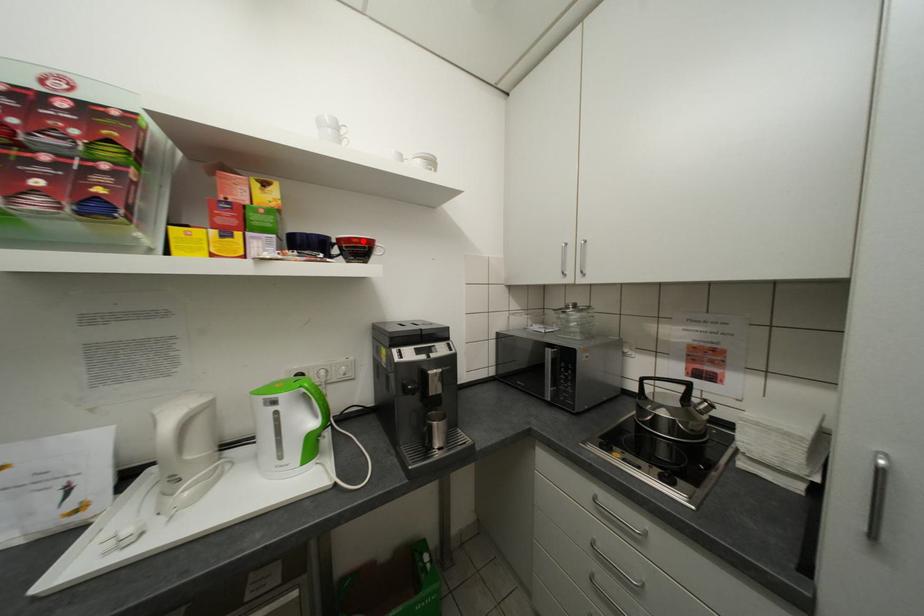
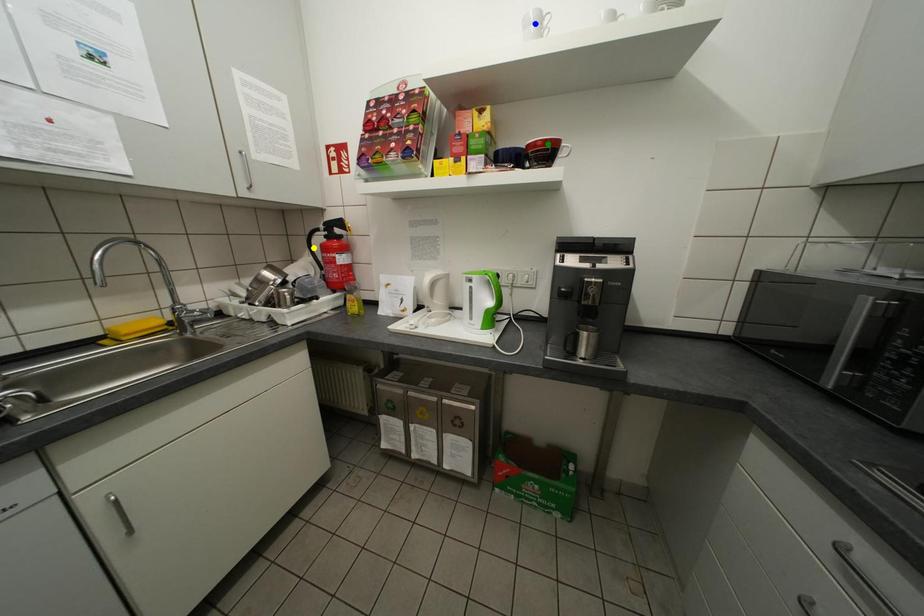
Question: I am providing you with two images of the same scene from different viewpoints. A red point is marked on the first image. You are given multiple points on the second image. Which point in image 2 is actually the same real-world point as the red point in image 1?

Choices:
 (A) green point
 (B) yellow point
 (C) blue point

Answer: (A)